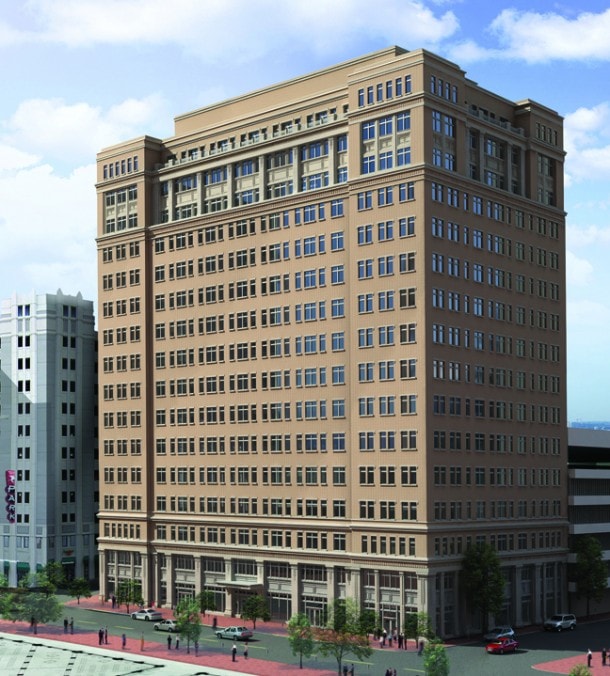
Locate an element on the screen. Image resolution: width=610 pixels, height=676 pixels. glass is located at coordinates (411, 623).